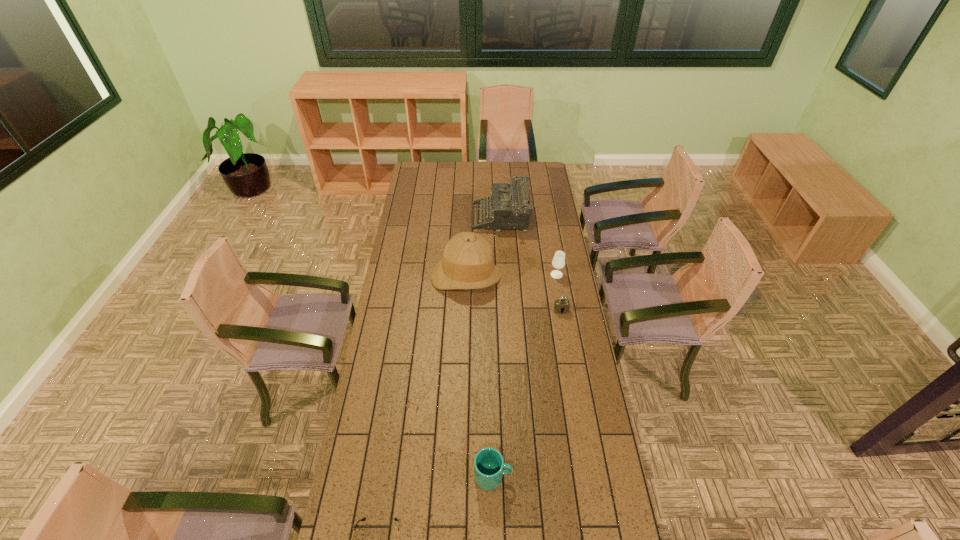
Identify the location of vacant space located on the typing side of the second tallest object. (408, 219).

Find the location of `free spot located on the typing side of the second tallest object`. free spot located on the typing side of the second tallest object is located at coordinates (426, 219).

At what (x,y) coordinates should I click in order to perform the action: click on vacant space located 0.090m on the front of the glass. Please return your answer as a coordinate pair (x, y). Looking at the image, I should click on (560, 293).

What are the coordinates of `vacant region located 0.320m on the handle side of the cup` in the screenshot? It's located at (607, 476).

What are the coordinates of `free space located at the front of the padlock near the keyhole` in the screenshot? It's located at (575, 393).

The width and height of the screenshot is (960, 540). In order to click on typewriter that is at the right edge in this screenshot , I will do [509, 207].

At what (x,y) coordinates should I click in order to perform the action: click on glass present at the right edge. Please return your answer as a coordinate pair (x, y). Image resolution: width=960 pixels, height=540 pixels. Looking at the image, I should click on click(558, 262).

Locate an element on the screen. This screenshot has height=540, width=960. padlock that is at the right edge is located at coordinates (562, 305).

Where is `vacant space at the far edge of the desktop`? The image size is (960, 540). vacant space at the far edge of the desktop is located at coordinates (446, 177).

In the image, there is a desktop. Identify the location of free space at the left edge. (412, 184).